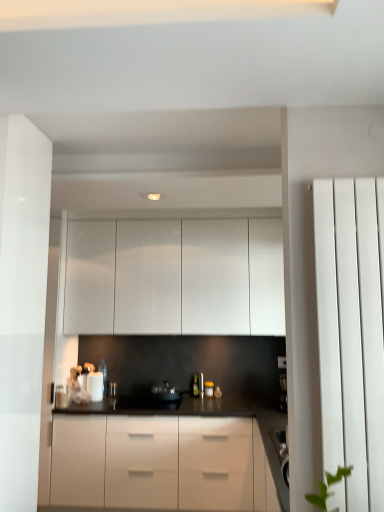
Describe the element at coordinates (175, 277) in the screenshot. I see `white glossy cabinets at upper center` at that location.

The image size is (384, 512). Describe the element at coordinates (160, 458) in the screenshot. I see `black matte countertop at center` at that location.

In order to face black plastic coffee machine at right, should I rotate leftwards or rightwards?

You should rotate right by 12.076 degrees.

This screenshot has width=384, height=512. Identify the location of matte silver faucet at center. (201, 385).

Locate an element on the screen. This screenshot has width=384, height=512. white glossy cabinets at upper center is located at coordinates (175, 277).

From a real-world perspective, is black plastic coffee machine at right positioned above or below black matte countertop at center?

black plastic coffee machine at right is situated higher than black matte countertop at center in the real world.

Does black plastic coffee machine at right have a smaller size compared to black matte countertop at center?

Correct, black plastic coffee machine at right occupies less space than black matte countertop at center.

Which object is wider, black plastic coffee machine at right or black matte countertop at center?

Wider between the two is black matte countertop at center.

Between black plastic coffee machine at right and black matte countertop at center, which one has more height?

With more height is black matte countertop at center.

From the image's perspective, is matte silver faucet at center above white smooth radiator at right?

No.

Does matte silver faucet at center have a lesser width compared to white smooth radiator at right?

No, matte silver faucet at center is not thinner than white smooth radiator at right.

Considering the sizes of objects matte silver faucet at center and white smooth radiator at right in the image provided, who is smaller, matte silver faucet at center or white smooth radiator at right?

matte silver faucet at center is smaller.

Can black matte countertop at center be found inside white smooth radiator at right?

That's incorrect, black matte countertop at center is not inside white smooth radiator at right.

Based on the photo, between white smooth radiator at right and black matte countertop at center, which one appears on the left side from the viewer's perspective?

black matte countertop at center.

From their relative heights in the image, would you say white smooth radiator at right is taller or shorter than black matte countertop at center?

white smooth radiator at right is taller than black matte countertop at center.

How different are the orientations of white smooth radiator at right and black matte countertop at center in degrees?

There is a 0.00143-degree angle between the facing directions of white smooth radiator at right and black matte countertop at center.

What's the angular difference between black plastic coffee machine at right and black glossy kettle at center's facing directions?

0.000178 degrees separate the facing orientations of black plastic coffee machine at right and black glossy kettle at center.

What are the coordinates of `coffee machine in front of the black glossy kettle at center` in the screenshot? It's located at (282, 382).

Is black plastic coffee machine at right looking in the opposite direction of black glossy kettle at center?

That's not correct — black plastic coffee machine at right is not looking away from black glossy kettle at center.

Is black plastic coffee machine at right wider or thinner than black glossy kettle at center?

In the image, black plastic coffee machine at right appears to be more narrow than black glossy kettle at center.

Is white smooth radiator at right looking in the opposite direction of black glossy kettle at center?

white smooth radiator at right is not turned away from black glossy kettle at center.

Is white smooth radiator at right positioned before black glossy kettle at center?

Yes, it is in front of black glossy kettle at center.

Consider the image. Are white smooth radiator at right and black glossy kettle at center far apart?

white smooth radiator at right is positioned a significant distance from black glossy kettle at center.

From a real-world perspective, is white smooth radiator at right under black glossy kettle at center?

No, from a real-world perspective, white smooth radiator at right is not below black glossy kettle at center.

From a real-world perspective, is black matte countertop at center located higher than black plastic coffee machine at right?

No, from a real-world perspective, black matte countertop at center is not above black plastic coffee machine at right.

Does black matte countertop at center appear on the right side of black plastic coffee machine at right?

No, black matte countertop at center is not to the right of black plastic coffee machine at right.

Would you consider black matte countertop at center to be distant from black plastic coffee machine at right?

black matte countertop at center is positioned a significant distance from black plastic coffee machine at right.

Locate an element on the screen. countertop on the left side of black plastic coffee machine at right is located at coordinates (160, 458).

How many degrees apart are the facing directions of black glossy kettle at center and matte silver faucet at center?

0.000347 degrees.

From a real-world perspective, is black glossy kettle at center positioned above or below matte silver faucet at center?

In terms of real-world spatial position, black glossy kettle at center is below matte silver faucet at center.

From the image's perspective, is black glossy kettle at center beneath matte silver faucet at center?

Yes, from the image's perspective, black glossy kettle at center is beneath matte silver faucet at center.

Is black glossy kettle at center to the left or to the right of matte silver faucet at center in the image?

black glossy kettle at center is to the left of matte silver faucet at center.

Locate an element on the screen. This screenshot has width=384, height=512. countertop below the black plastic coffee machine at right (from the image's perspective) is located at coordinates (160, 458).

Image resolution: width=384 pixels, height=512 pixels. In order to click on screen door on the right side of matte silver faucet at center in this screenshot , I will do `click(350, 338)`.

When comparing their distances from black matte countertop at center, does matte silver faucet at center or white smooth radiator at right seem closer?

matte silver faucet at center lies closer to black matte countertop at center than the other object.

Which object lies nearer to the anchor point black matte countertop at center, white glossy cabinets at upper center or black glossy kettle at center?

black glossy kettle at center lies closer to black matte countertop at center than the other object.

From the image, which object appears to be farther from black glossy kettle at center, black plastic coffee machine at right or white glossy cabinets at upper center?

Based on the image, white glossy cabinets at upper center appears to be further to black glossy kettle at center.

Based on their spatial positions, is black matte countertop at center or white glossy cabinets at upper center further from white smooth radiator at right?

white glossy cabinets at upper center is further to white smooth radiator at right.

When comparing their distances from white glossy cabinets at upper center, does black plastic coffee machine at right or black glossy kettle at center seem closer?

black glossy kettle at center is closer to white glossy cabinets at upper center.

Estimate the real-world distances between objects in this image. Which object is closer to black matte countertop at center, matte silver faucet at center or black glossy kettle at center?

The object closer to black matte countertop at center is black glossy kettle at center.

Estimate the real-world distances between objects in this image. Which object is closer to black glossy kettle at center, black matte countertop at center or black plastic coffee machine at right?

black matte countertop at center is positioned closer to the anchor black glossy kettle at center.

From the image, which object appears to be nearer to white smooth radiator at right, black plastic coffee machine at right or black glossy kettle at center?

black plastic coffee machine at right.

The height and width of the screenshot is (512, 384). Find the location of `faucet between black glossy kettle at center and black plastic coffee machine at right in the horizontal direction`. faucet between black glossy kettle at center and black plastic coffee machine at right in the horizontal direction is located at coordinates (201, 385).

At what (x,y) coordinates should I click in order to perform the action: click on cabinetry between white smooth radiator at right and black glossy kettle at center in the front-back direction. Please return your answer as a coordinate pair (x, y). The height and width of the screenshot is (512, 384). Looking at the image, I should click on (175, 277).

Locate an element on the screen. This screenshot has height=512, width=384. appliance between white smooth radiator at right and matte silver faucet at center in the front-back direction is located at coordinates pyautogui.click(x=165, y=392).

This screenshot has width=384, height=512. I want to click on faucet between black matte countertop at center and black plastic coffee machine at right, so tap(201, 385).